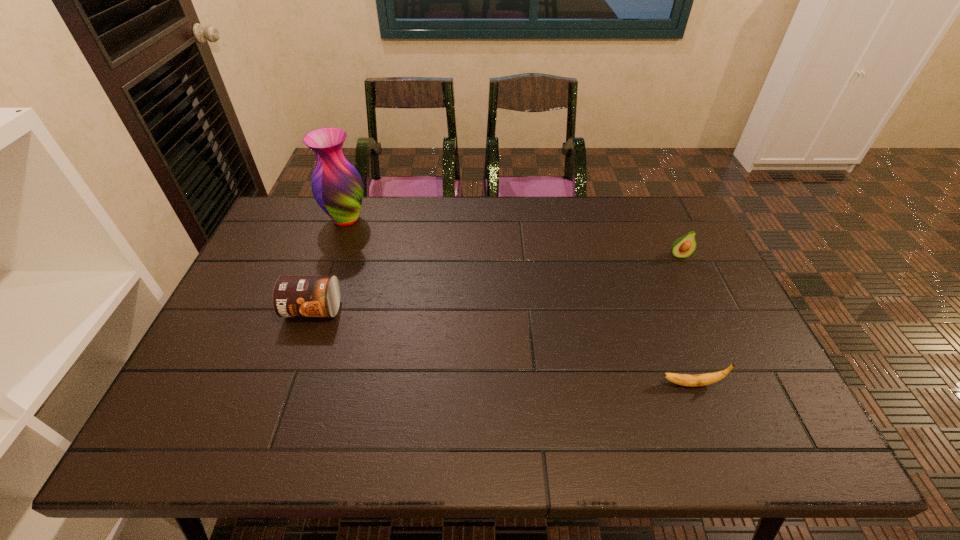
Identify the location of unoccupied area between the tallest object and the second object from right to left. The width and height of the screenshot is (960, 540). click(x=518, y=301).

Find the location of a particular element. The image size is (960, 540). vacant space that's between the farthest object and the second object from right to left is located at coordinates (518, 301).

The image size is (960, 540). Identify the location of free spot between the rightmost object and the third farthest object. (496, 282).

This screenshot has height=540, width=960. What are the coordinates of `object that ranks as the second closest to the avocado` in the screenshot? It's located at (337, 187).

Choose which object is the third nearest neighbor to the can. Please provide its 2D coordinates. Your answer should be formatted as a tuple, i.e. [(x, y)], where the tuple contains the x and y coordinates of a point satisfying the conditions above.

[(683, 247)]

The width and height of the screenshot is (960, 540). Identify the location of vacant area in the image that satisfies the following two spatial constraints: 1. on the cut side of the rightmost object; 2. on the peel of the nearest object from the top. (740, 384).